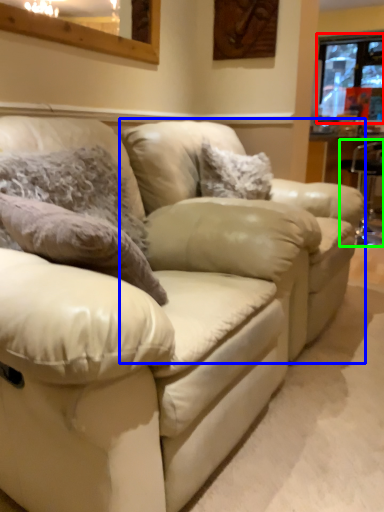
Question: Considering the real-world distances, which object is farthest from window (highlighted by a red box)? swivel chair (highlighted by a blue box) or bar stool (highlighted by a green box)?

Choices:
 (A) swivel chair
 (B) bar stool

Answer: (A)